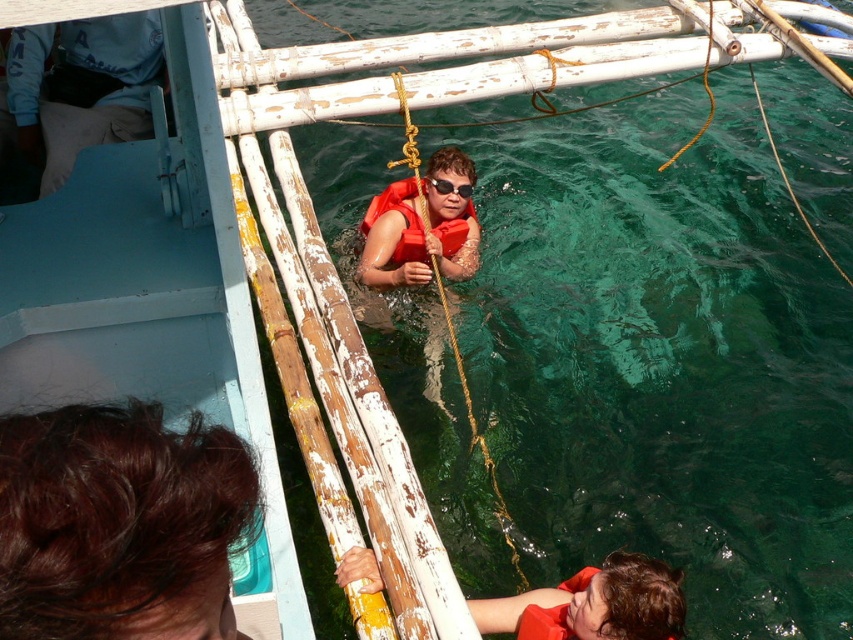
Does dark brown hair at lower left have a larger size compared to orange life jacket at center?

Actually, dark brown hair at lower left might be smaller than orange life jacket at center.

Is point (221, 563) positioned after point (426, 182)?

No, it is not.

Find the location of a particular element. The width and height of the screenshot is (853, 640). dark brown hair at lower left is located at coordinates (119, 524).

Between orange life jacket at center and black plastic goggles at center, which one is positioned lower?

orange life jacket at center is below.

Does orange life jacket at center have a greater width compared to black plastic goggles at center?

Indeed, orange life jacket at center has a greater width compared to black plastic goggles at center.

This screenshot has height=640, width=853. What do you see at coordinates (404, 221) in the screenshot?
I see `orange life jacket at center` at bounding box center [404, 221].

Find the location of `orange life jacket at center`. orange life jacket at center is located at coordinates (404, 221).

Which is more to the left, matte orange life vest at lower center or orange life jacket at center?

orange life jacket at center

Is matte orange life vest at lower center to the left of orange life jacket at center from the viewer's perspective?

In fact, matte orange life vest at lower center is to the right of orange life jacket at center.

Identify the location of matte orange life vest at lower center. (593, 604).